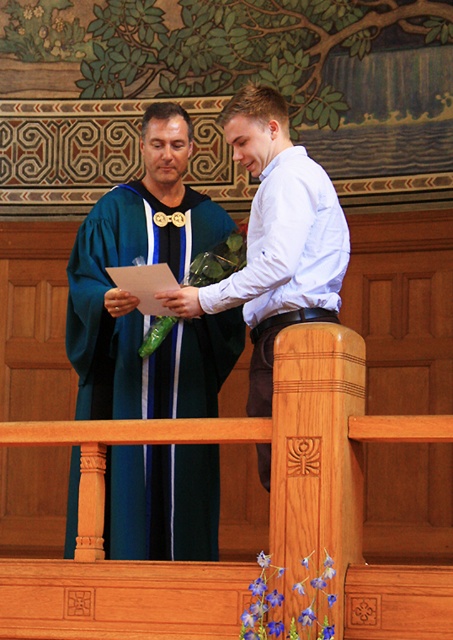
Does teal satin gown at center have a lesser height compared to matte green robe at center?

Yes, teal satin gown at center is shorter than matte green robe at center.

Is teal satin gown at center closer to the viewer compared to matte green robe at center?

No, it is behind matte green robe at center.

The image size is (453, 640). Describe the element at coordinates (141, 314) in the screenshot. I see `teal satin gown at center` at that location.

This screenshot has width=453, height=640. What are the coordinates of `teal satin gown at center` in the screenshot? It's located at (141, 314).